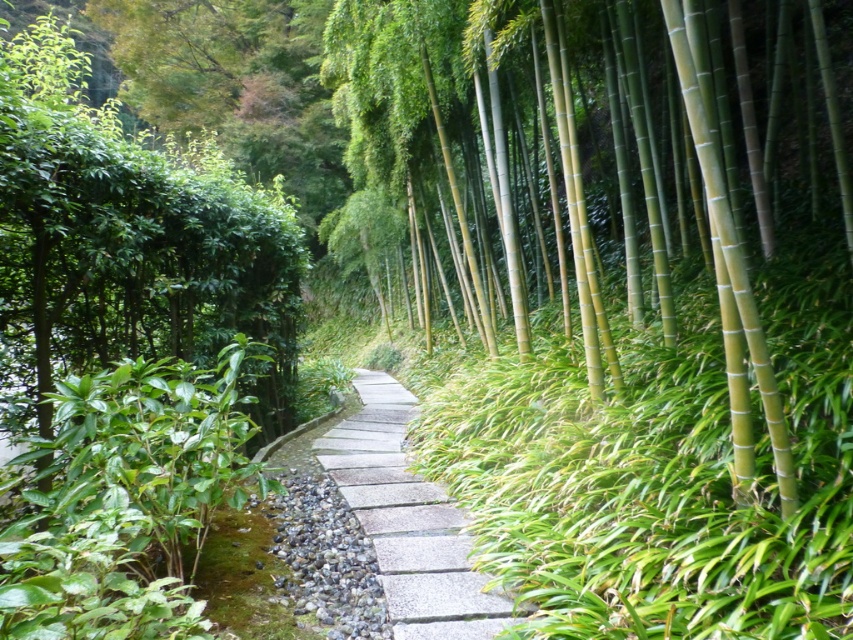
Can you confirm if green smooth bamboo at right is positioned to the left of gray stone path at center?

Incorrect, green smooth bamboo at right is not on the left side of gray stone path at center.

Can you confirm if green smooth bamboo at right is positioned to the right of gray stone path at center?

Yes, green smooth bamboo at right is to the right of gray stone path at center.

What are the coordinates of `green smooth bamboo at right` in the screenshot? It's located at (583, 157).